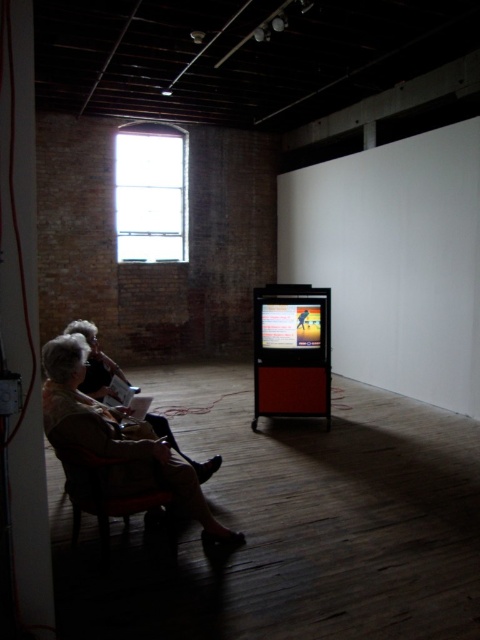
Question: Observing the image, what is the correct spatial positioning of matte beige sweater at left in reference to dark brown leather armchair at lower left?

Choices:
 (A) below
 (B) above

Answer: (B)

Question: Which point is farther to the camera?

Choices:
 (A) (106, 556)
 (B) (56, 428)

Answer: (A)

Question: Can you confirm if matte beige sweater at left is positioned below dark brown leather armchair at lower left?

Choices:
 (A) yes
 (B) no

Answer: (B)

Question: Which object is closer to the camera taking this photo?

Choices:
 (A) matte beige sweater at left
 (B) dark brown leather armchair at lower left

Answer: (A)

Question: Which point is closer to the camera?

Choices:
 (A) (180, 461)
 (B) (156, 493)

Answer: (B)

Question: Does matte beige sweater at left appear under dark brown leather armchair at lower left?

Choices:
 (A) yes
 (B) no

Answer: (B)